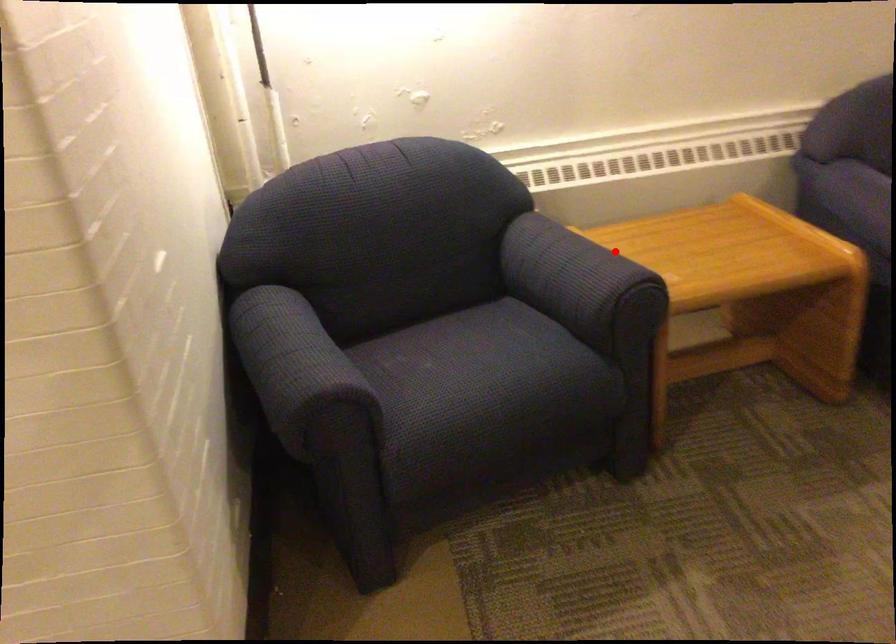
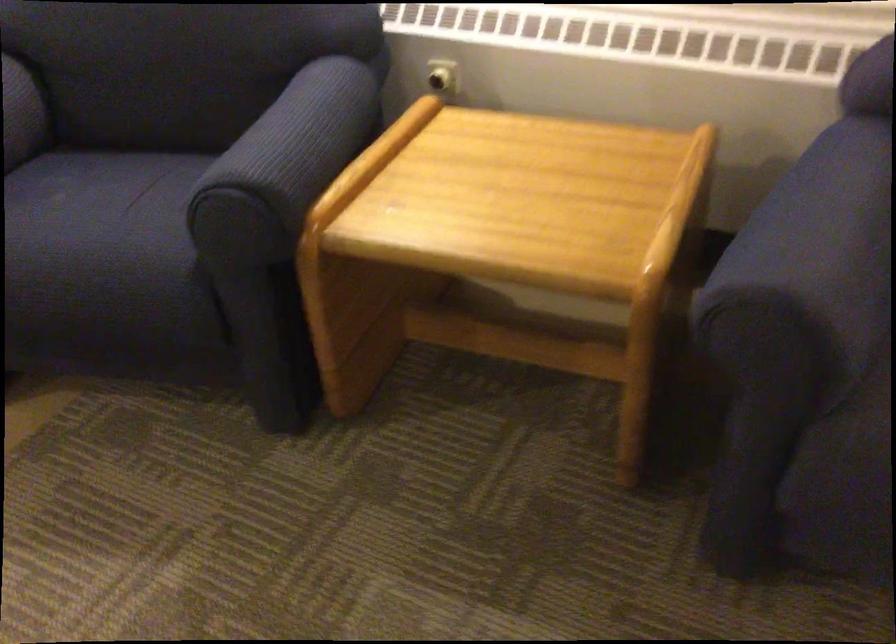
Find the pixel in the second image that matches the highlighted location in the first image.

(295, 144)